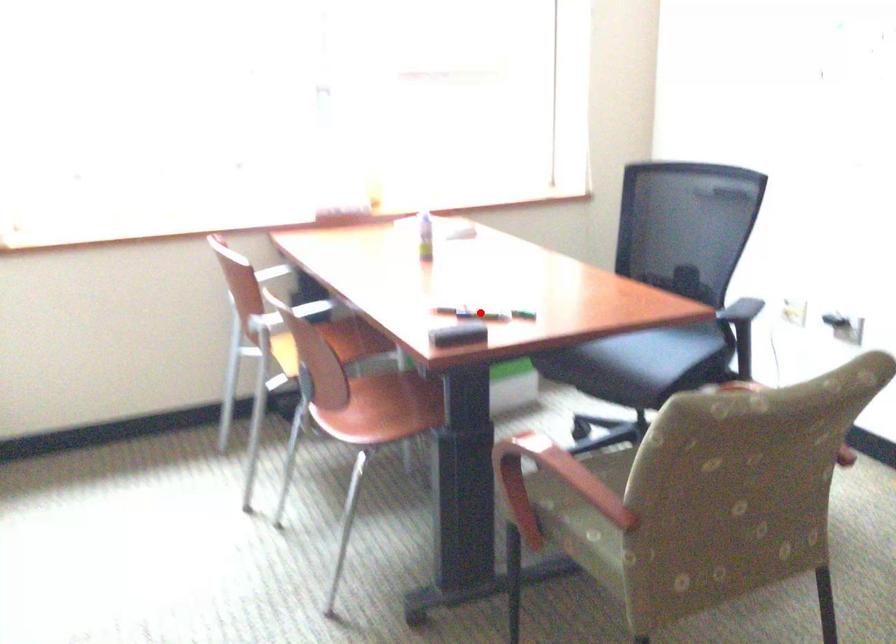
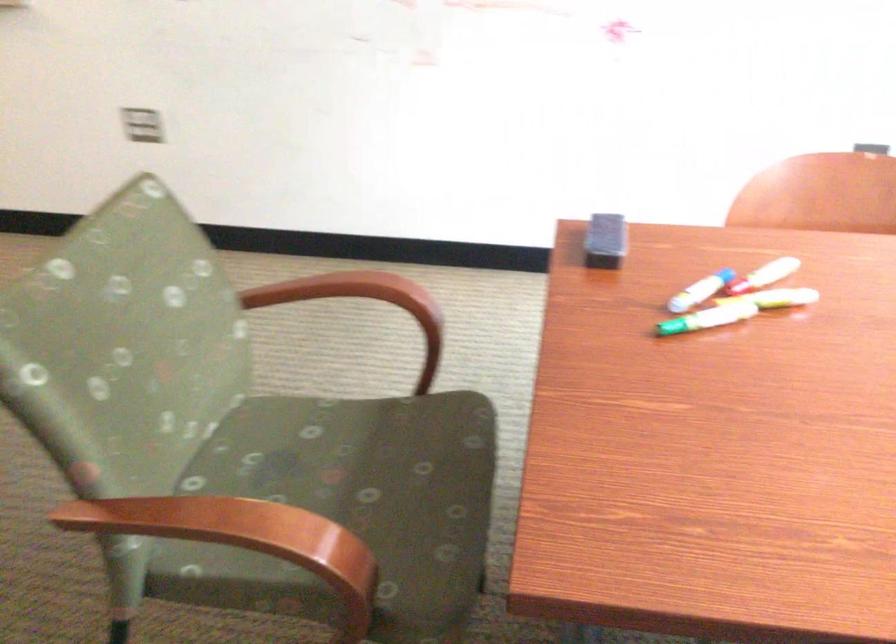
Where in the second image is the point corresponding to the highlighted location from the first image?

(700, 290)